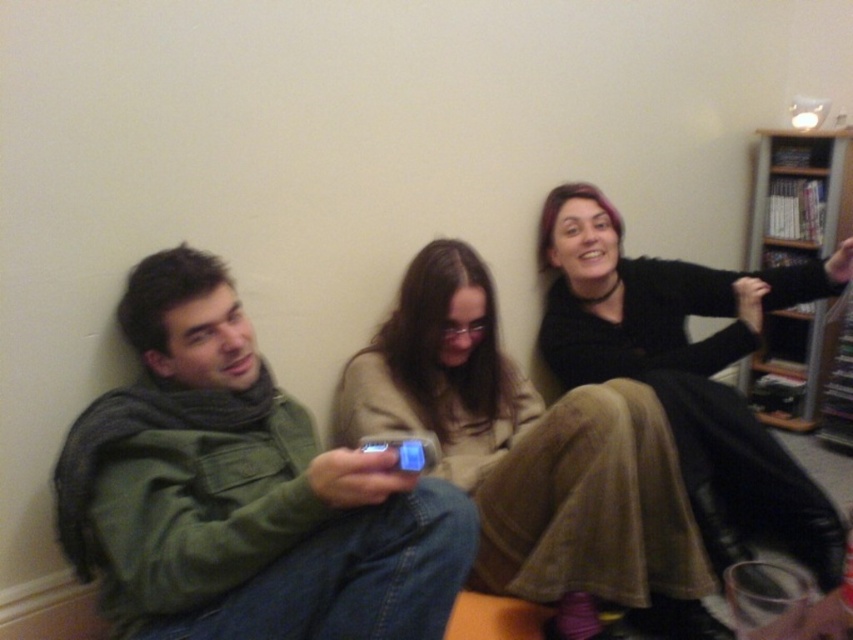
Which is behind, point (90, 522) or point (480, 314)?

The point (480, 314) is behind.

Is green matte jacket at center shorter than matte beige pants at center?

Yes.

This screenshot has width=853, height=640. Identify the location of green matte jacket at center. (242, 492).

The height and width of the screenshot is (640, 853). I want to click on green matte jacket at center, so click(x=242, y=492).

Between matte beige pants at center and wooden bookshelf at upper right, which one is positioned higher?

wooden bookshelf at upper right

Is matte beige pants at center closer to camera compared to wooden bookshelf at upper right?

Yes.

Which is in front, point (457, 428) or point (747, 378)?

Point (457, 428)

Locate an element on the screen. matte beige pants at center is located at coordinates 532,452.

Looking at this image, can you confirm if green matte jacket at center is bigger than wooden bookshelf at upper right?

Correct, green matte jacket at center is larger in size than wooden bookshelf at upper right.

Who is positioned more to the left, green matte jacket at center or wooden bookshelf at upper right?

From the viewer's perspective, green matte jacket at center appears more on the left side.

What do you see at coordinates (242, 492) in the screenshot? The image size is (853, 640). I see `green matte jacket at center` at bounding box center [242, 492].

At what (x,y) coordinates should I click in order to perform the action: click on green matte jacket at center. Please return your answer as a coordinate pair (x, y). The width and height of the screenshot is (853, 640). Looking at the image, I should click on (242, 492).